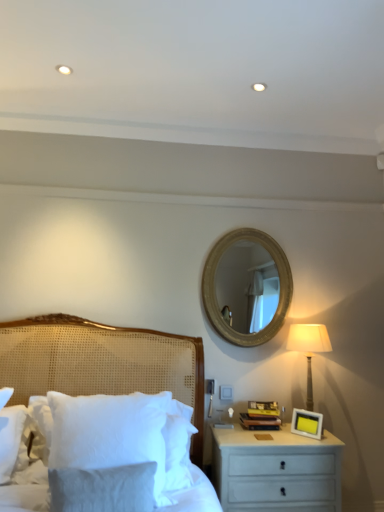
Question: Is white woven bed at left bigger than yellow matte picture frame at right?

Choices:
 (A) yes
 (B) no

Answer: (A)

Question: Does white woven bed at left have a smaller size compared to yellow matte picture frame at right?

Choices:
 (A) no
 (B) yes

Answer: (A)

Question: Is white woven bed at left surrounding yellow matte picture frame at right?

Choices:
 (A) yes
 (B) no

Answer: (B)

Question: Can you confirm if white woven bed at left is thinner than yellow matte picture frame at right?

Choices:
 (A) yes
 (B) no

Answer: (B)

Question: Does white woven bed at left have a greater width compared to yellow matte picture frame at right?

Choices:
 (A) yes
 (B) no

Answer: (A)

Question: Is the position of white woven bed at left less distant than that of yellow matte picture frame at right?

Choices:
 (A) no
 (B) yes

Answer: (B)

Question: Considering the relative positions of white painted wood nightstand at lower right and yellow matte picture frame at right in the image provided, is white painted wood nightstand at lower right to the left of yellow matte picture frame at right from the viewer's perspective?

Choices:
 (A) no
 (B) yes

Answer: (B)

Question: Is white painted wood nightstand at lower right facing towards yellow matte picture frame at right?

Choices:
 (A) yes
 (B) no

Answer: (B)

Question: Is white painted wood nightstand at lower right at the right side of yellow matte picture frame at right?

Choices:
 (A) yes
 (B) no

Answer: (B)

Question: From a real-world perspective, is white painted wood nightstand at lower right on top of yellow matte picture frame at right?

Choices:
 (A) yes
 (B) no

Answer: (B)

Question: Is white painted wood nightstand at lower right closer to the viewer compared to yellow matte picture frame at right?

Choices:
 (A) yes
 (B) no

Answer: (A)

Question: Considering the relative sizes of white painted wood nightstand at lower right and yellow matte picture frame at right in the image provided, is white painted wood nightstand at lower right taller than yellow matte picture frame at right?

Choices:
 (A) no
 (B) yes

Answer: (B)

Question: From a real-world perspective, is white painted wood nightstand at lower right physically above white woven bed at left?

Choices:
 (A) yes
 (B) no

Answer: (B)